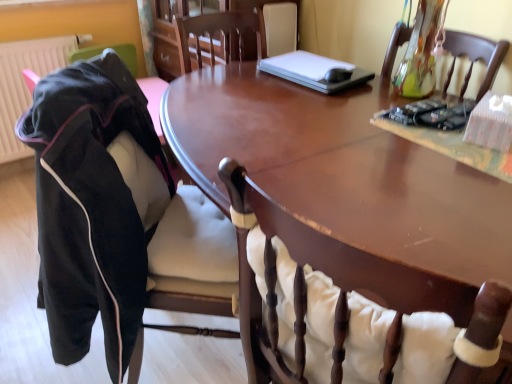
I want to click on free point above matte plastic radiator at left (from a real-world perspective), so click(x=39, y=34).